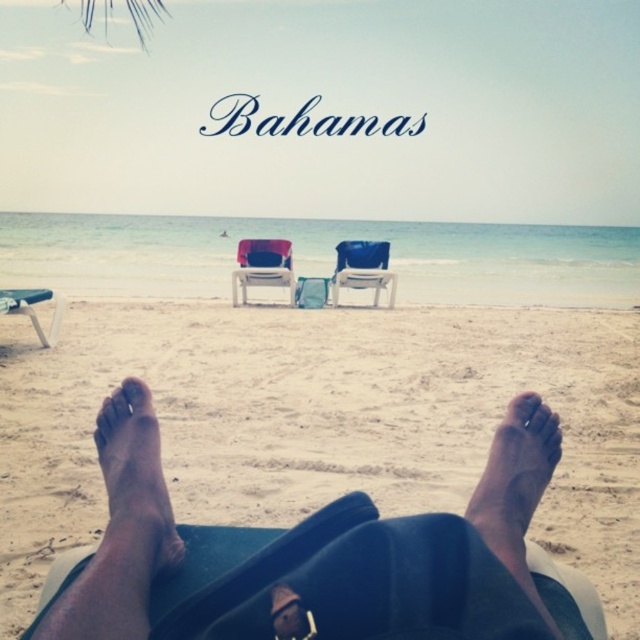
Is point (481, 532) in front of point (348, 288)?

Yes, point (481, 532) is in front of point (348, 288).

Is brown skin at lower center taller than blue plastic chair at center?

No, brown skin at lower center is not taller than blue plastic chair at center.

Which is behind, point (474, 506) or point (342, 285)?

The point (342, 285) is more distant.

This screenshot has width=640, height=640. I want to click on brown skin at lower center, so click(x=515, y=474).

Describe the element at coordinates (324, 394) in the screenshot. I see `white sandy beach at lower center` at that location.

Is point (36, 380) positioned behind point (180, 550)?

Yes, it is.

The height and width of the screenshot is (640, 640). I want to click on white sandy beach at lower center, so click(x=324, y=394).

Who is positioned more to the right, white sandy beach at lower center or blue plastic chair at center?

From the viewer's perspective, white sandy beach at lower center appears more on the right side.

Is point (26, 547) behind point (371, 244)?

No, it is in front of (371, 244).

Locate an element on the screen. white sandy beach at lower center is located at coordinates (324, 394).